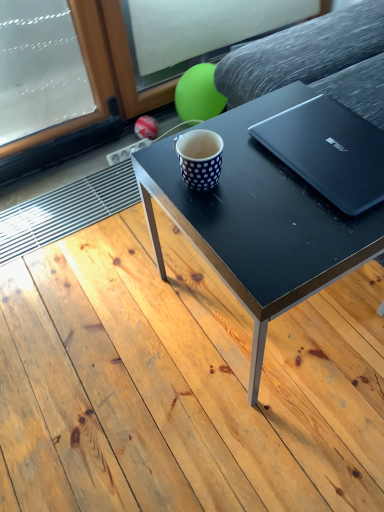
Where is `vacant region above black matte coffee table at center (from a real-world perspective)`? vacant region above black matte coffee table at center (from a real-world perspective) is located at coordinates (288, 173).